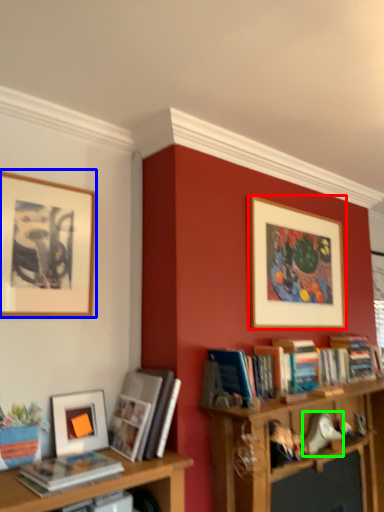
Question: Estimate the real-world distances between objects in this image. Which object is farther from picture frame (highlighted by a red box), picture frame (highlighted by a blue box) or toy (highlighted by a green box)?

Choices:
 (A) picture frame
 (B) toy

Answer: (A)